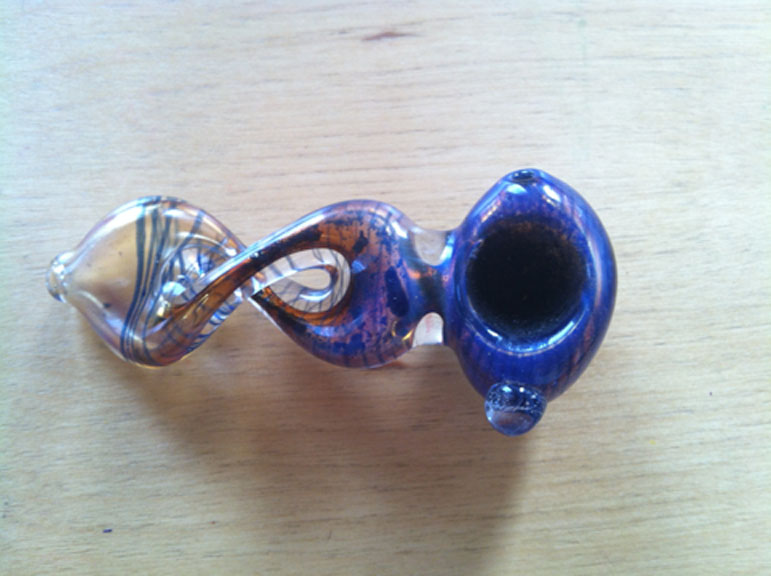
Identify the location of table. The width and height of the screenshot is (771, 576). (x=372, y=466).